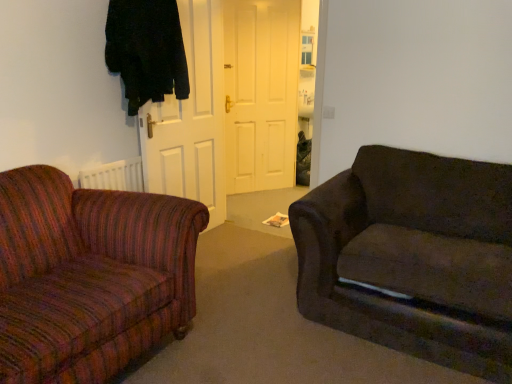
The height and width of the screenshot is (384, 512). Find the location of `empty space that is to the right of white matte door at center, marked as the second door in a right-to-left arrangement`. empty space that is to the right of white matte door at center, marked as the second door in a right-to-left arrangement is located at coordinates (243, 245).